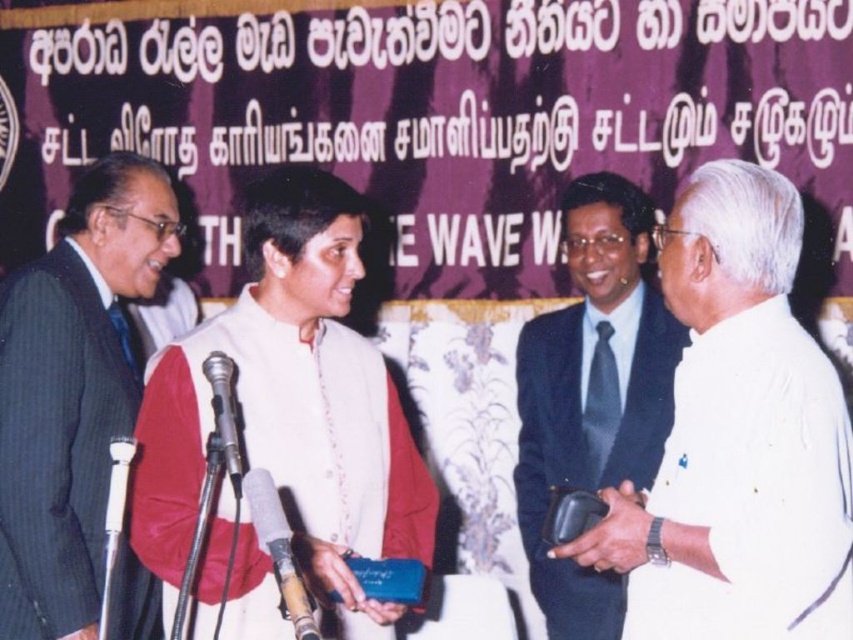
Does silver metallic microphone at center have a lesser height compared to metallic silver microphone at lower center?

No.

Who is higher up, silver metallic microphone at center or metallic silver microphone at lower center?

metallic silver microphone at lower center is higher up.

Find the location of a particular element. silver metallic microphone at center is located at coordinates (277, 548).

Who is more forward, (x=624, y=412) or (x=128, y=451)?

Point (x=128, y=451) is more forward.

Is dark blue suit at right smaller than white plastic microphone at left?

No, dark blue suit at right is not smaller than white plastic microphone at left.

Does point (527, 545) lie behind point (111, 451)?

Yes, point (527, 545) is farther from viewer.

Where is `dark blue suit at right`? dark blue suit at right is located at coordinates (593, 392).

Can you confirm if white matte vest at center is shorter than white plastic microphone at left?

No.

Where is `white matte vest at center`? The height and width of the screenshot is (640, 853). white matte vest at center is located at coordinates click(x=291, y=406).

Identify the location of white matte vest at center. (291, 406).